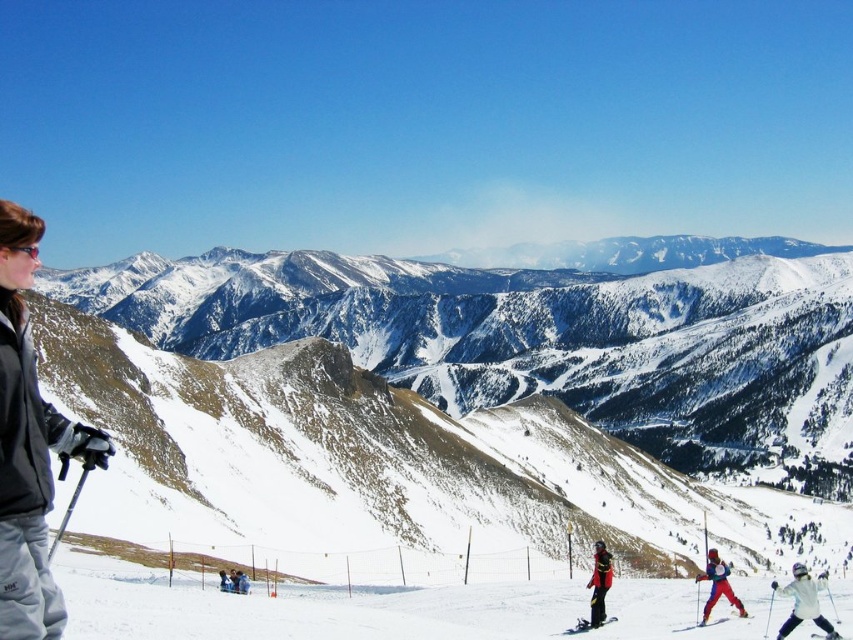
Question: Estimate the real-world distances between objects in this image. Which object is farther from the red ski suit at center?

Choices:
 (A) matte black goggles at upper left
 (B) gray fleece jacket at left

Answer: (A)

Question: Estimate the real-world distances between objects in this image. Which object is closer to the matte black goggles at upper left?

Choices:
 (A) snowy mountain at center
 (B) red jacket at center

Answer: (B)

Question: Is red jacket at center to the right of matte black goggles at upper left from the viewer's perspective?

Choices:
 (A) no
 (B) yes

Answer: (B)

Question: Which of the following is the closest to the observer?

Choices:
 (A) (585, 627)
 (B) (12, 442)
 (C) (744, 307)
 (D) (802, 614)

Answer: (B)

Question: From the image, what is the correct spatial relationship of red jacket at center in relation to matte black goggles at upper left?

Choices:
 (A) above
 (B) below

Answer: (B)

Question: Does gray fleece jacket at left have a larger size compared to red ski suit at center?

Choices:
 (A) no
 (B) yes

Answer: (B)